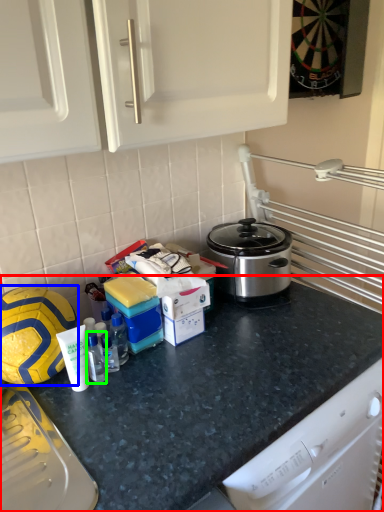
Question: Which object is positioned closest to countertop (highlighted by a red box)? Select from football (highlighted by a blue box) and bottle (highlighted by a green box).

Choices:
 (A) football
 (B) bottle

Answer: (B)